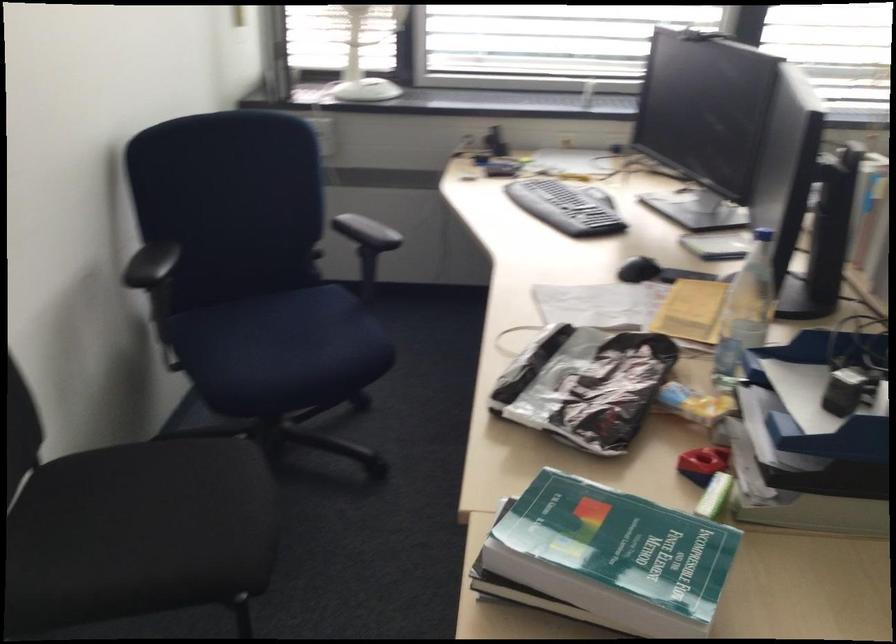
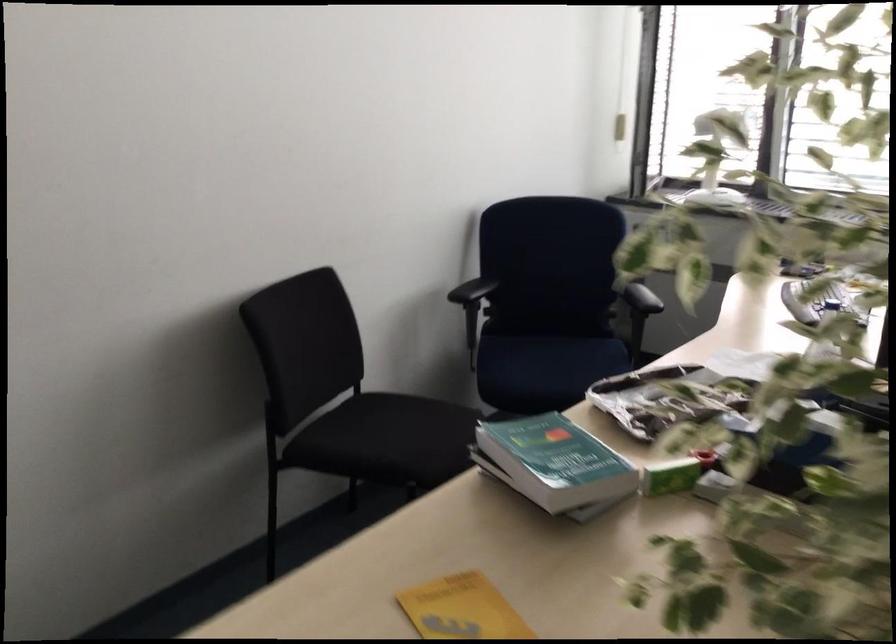
Locate, in the second image, the point that corresponds to point (289, 352) in the first image.

(547, 366)